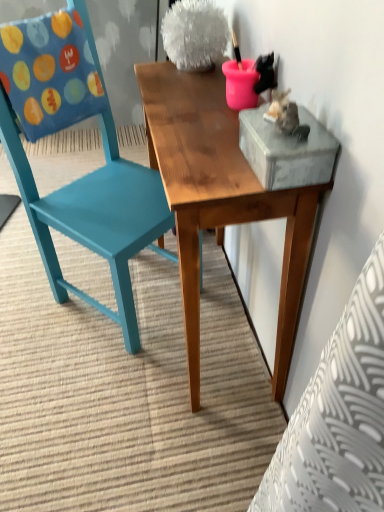
This screenshot has height=512, width=384. Find the location of `free area below wooden table at center (from a real-world perspective)`. free area below wooden table at center (from a real-world perspective) is located at coordinates (219, 328).